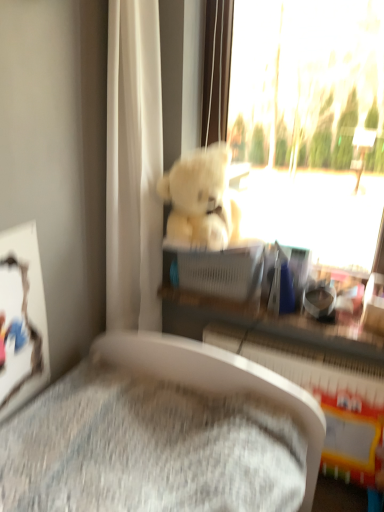
Find the location of a particular element. free space above matte plastic shelf at center (from a real-world perspective) is located at coordinates (268, 308).